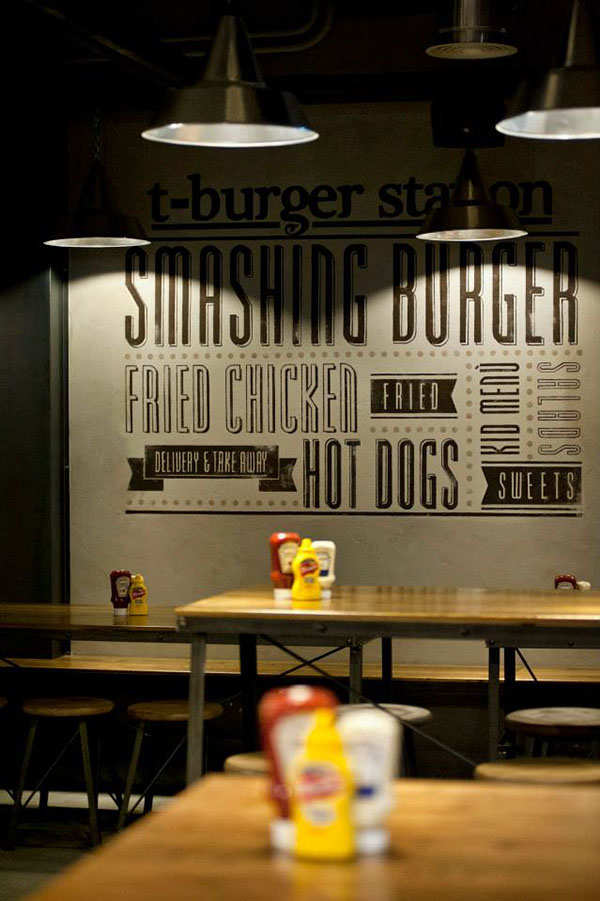
In order to click on lamp in this screenshot , I will do `click(99, 233)`, `click(235, 137)`, `click(483, 231)`, `click(553, 134)`.